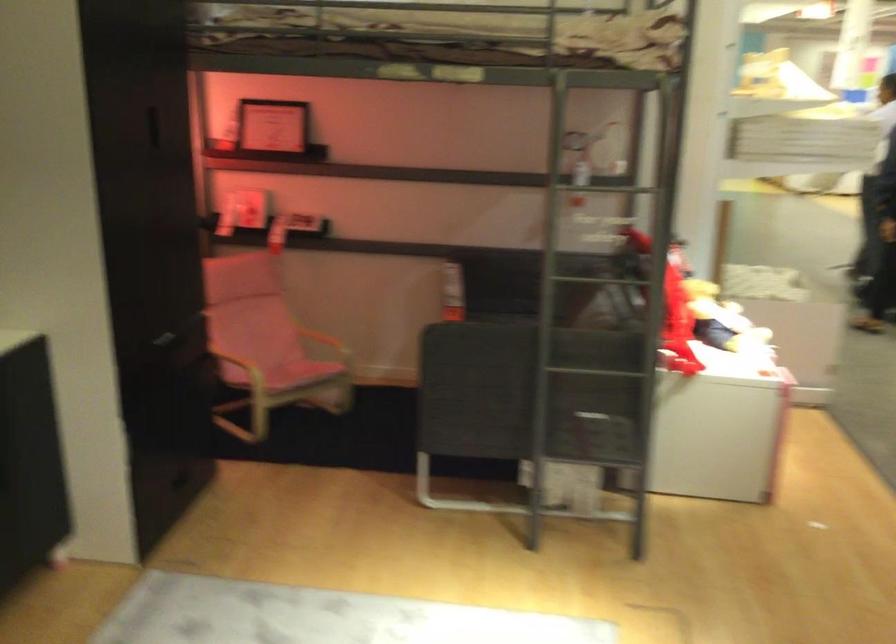
Identify the location of chair armrest. The image size is (896, 644). 332,328.